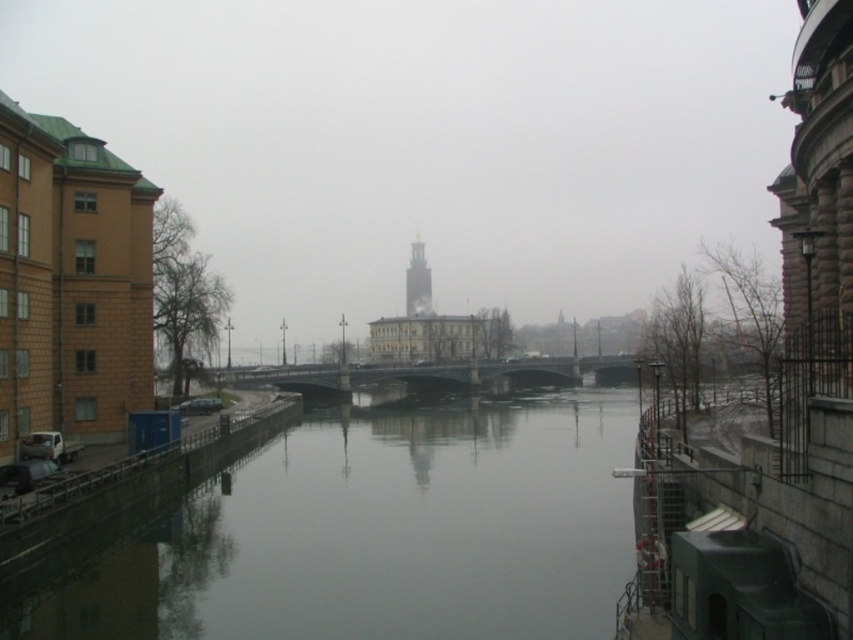
Looking at this image, you are a tourist standing on the left bank of the canal and want to take a photo of the gold textured tower at center without the smooth concrete river at center appearing in the frame. Is this possible?

The smooth concrete river at center is in front of the gold textured tower at center, so you cannot take a photo of the gold textured tower at center without the smooth concrete river at center appearing in the frame.

You are a drone operator who needs to fly a drone from the smooth concrete river at center to the gold textured tower at center. The drone has a maximum range of 150 meters. Can it reach the tower from the river?

The smooth concrete river at center is 171.15 meters from gold textured tower at center. Since the drone has a maximum range of 150 meters, it cannot reach the tower from the river.

In the scene shown: You are standing at the camera position and want to reach the point marked as point (410, 388). Is this point within a 150 meter walking distance?

The distance between the camera and point (410, 388) is 158.72 meters, which exceeds 150 meters. Therefore, the point is outside the 150 meter walking distance range.